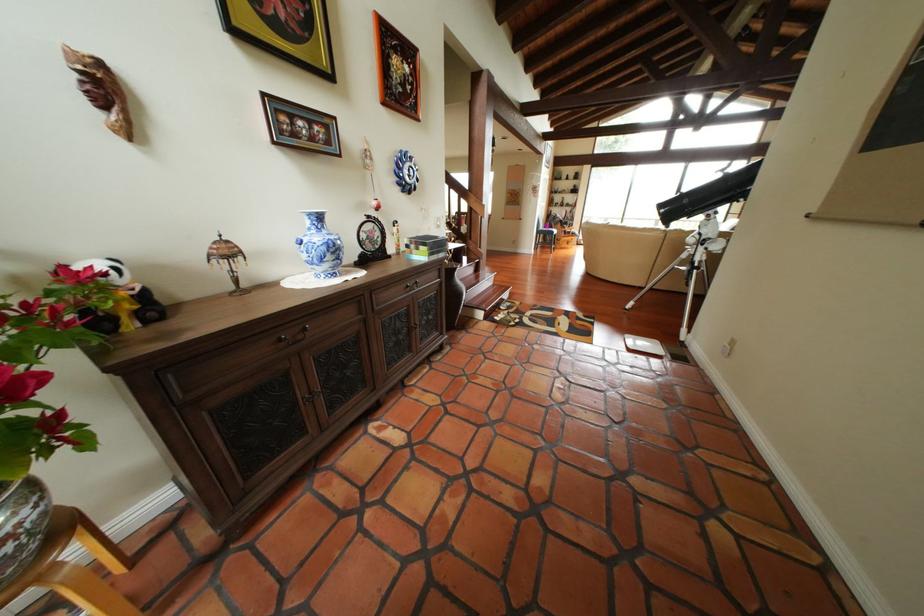
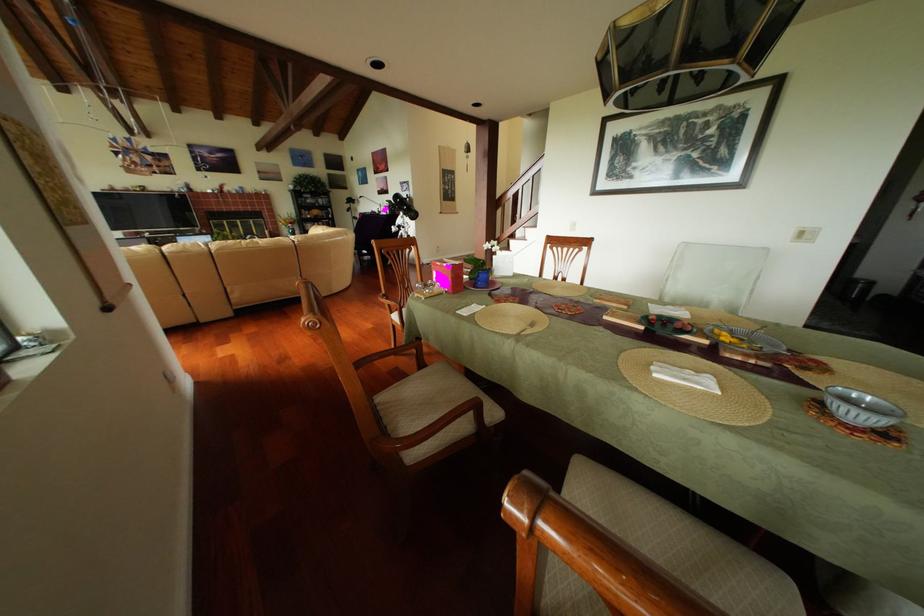
Question: I am providing you with two images of the same scene from different viewpoints. Please identify which objects are invisible in image2.

Choices:
 (A) metal fork
 (B) clear glass bowl
 (C) stack of books
 (D) white cushion

Answer: (C)